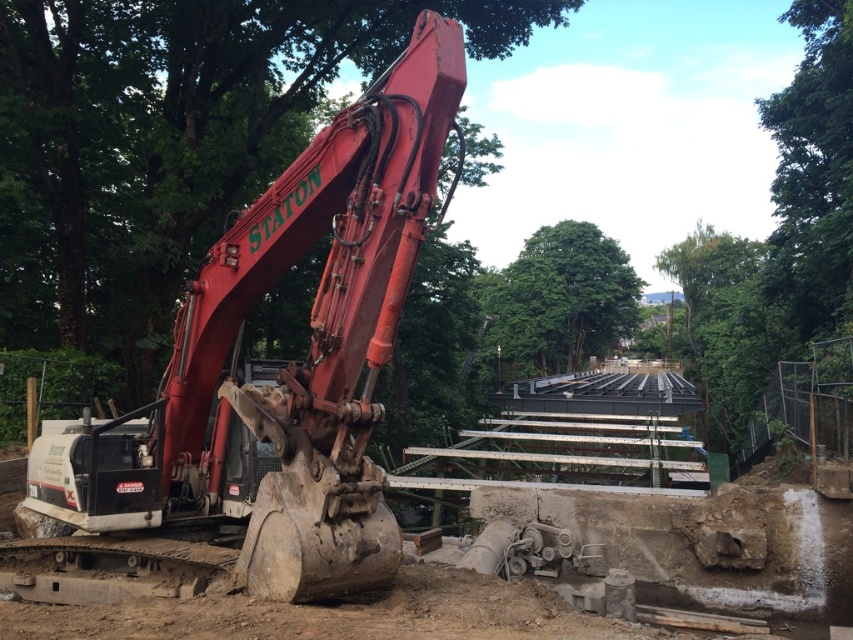
Who is lower down, matte red excavator at center or green leafy tree at center?

matte red excavator at center is below.

Can you confirm if matte red excavator at center is bigger than green leafy tree at center?

No.

Which is behind, point (363, 449) or point (534, 273)?

Point (534, 273)

This screenshot has height=640, width=853. What are the coordinates of `matte red excavator at center` in the screenshot? It's located at click(280, 362).